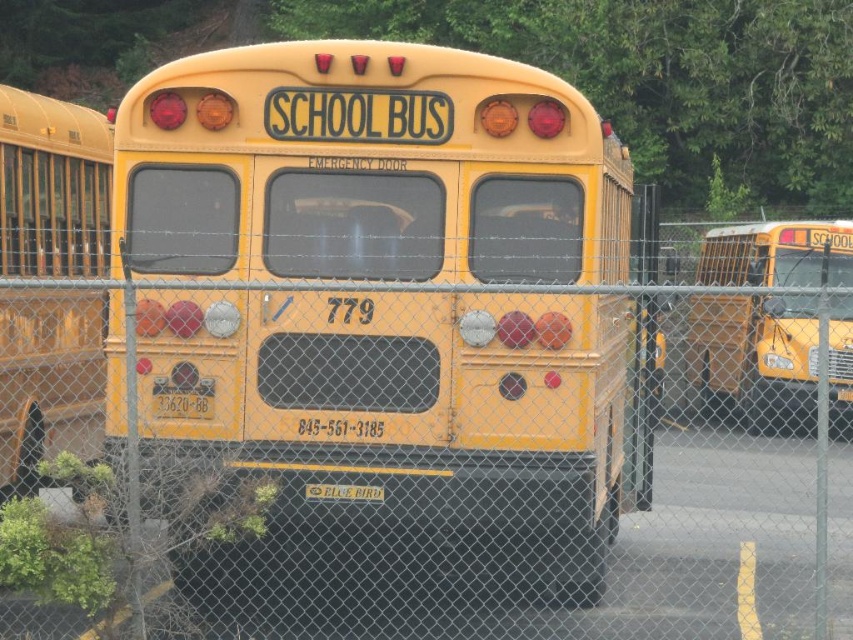
You are a photographer trying to capture both the matte yellow school bus at left and the yellow matte school bus at right in a single shot. Given that your camera can only focus on objects within a 10m range, and the smaller bus is 8m away, will both buses be in focus?

The matte yellow school bus at left is smaller than the yellow matte school bus at right. Since the smaller bus is 8m away and the camera can focus within 10m, both buses will be in focus as their distances are within the camera range.